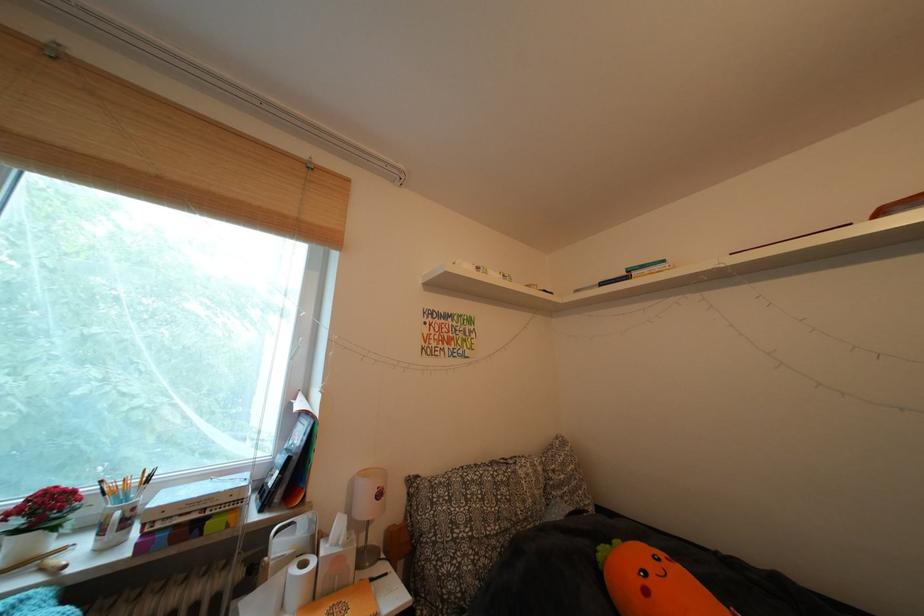
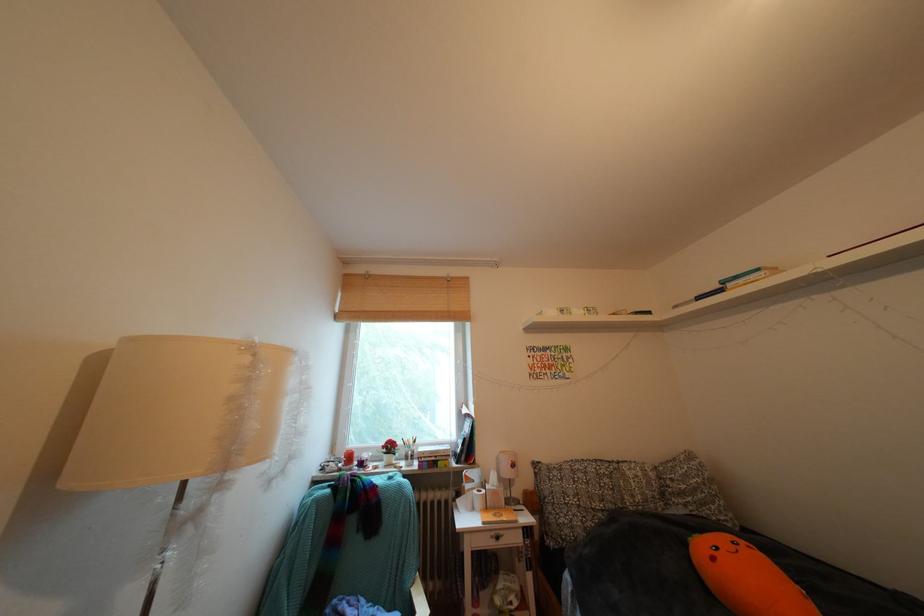
Find the pixel in the second image that matches point (674, 267) in the first image.

(768, 275)